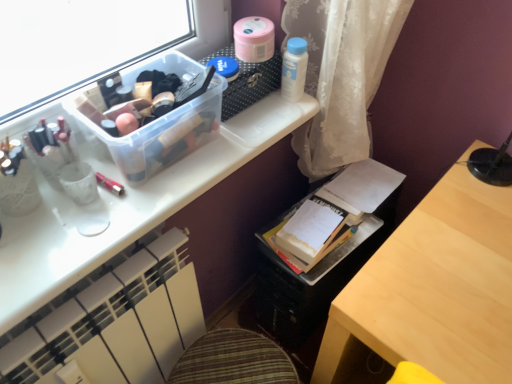
What are the coordinates of `vacant region above matte white desk at upper center (from a real-world perspective)` in the screenshot? It's located at (144, 170).